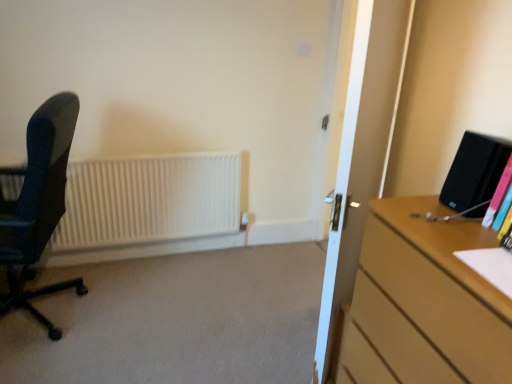
At what (x,y) coordinates should I click in order to perform the action: click on blank space situated above wooden desk at right (from a real-world perspective). Please return your answer as a coordinate pair (x, y). Looking at the image, I should click on (452, 230).